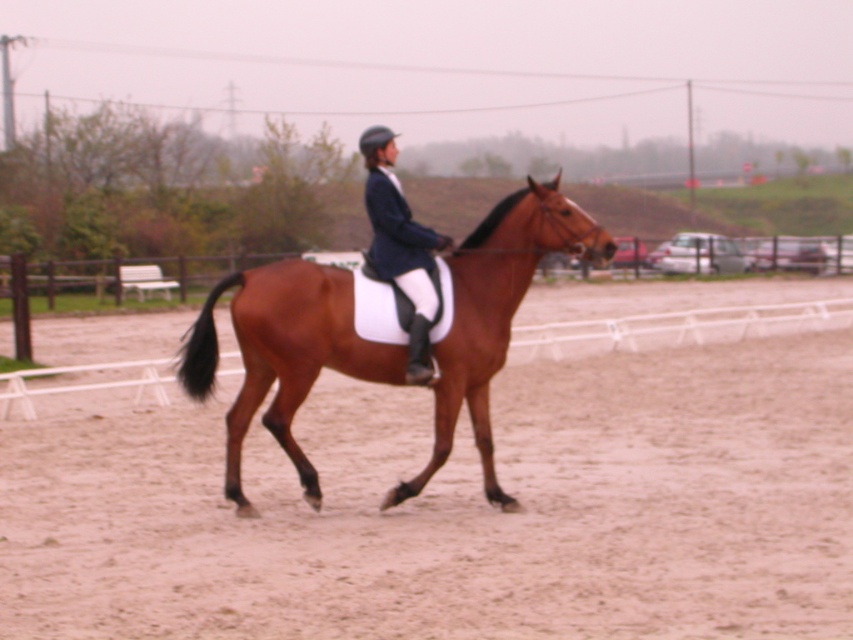
You are a photographer positioned at the front of the arena. You want to take a photo of the rider and horse. Since the rider is wearing a matte black jacket at center and the horse is a brown glossy horse at center, which one will appear closer to the camera in the photo?

The brown glossy horse at center is in front of the matte black jacket at center, so the horse will appear closer to the camera in the photo.

You are a spectator standing at the edge of the arena. You see the brown glossy horse at center and the matte black jacket at center. Which object is positioned more to the right side of the arena?

The brown glossy horse at center is positioned more to the right side of the arena than the matte black jacket at center.

You are a spectator standing at the edge of the arena. You see the brown glossy horse at center and the matte black jacket at center. Which object is taller?

The brown glossy horse at center is much taller than the matte black jacket at center.